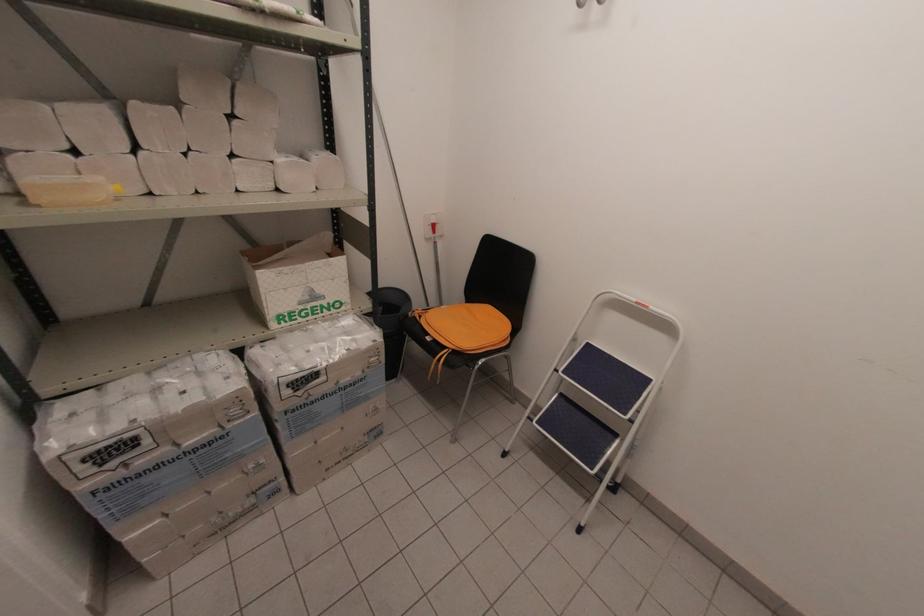
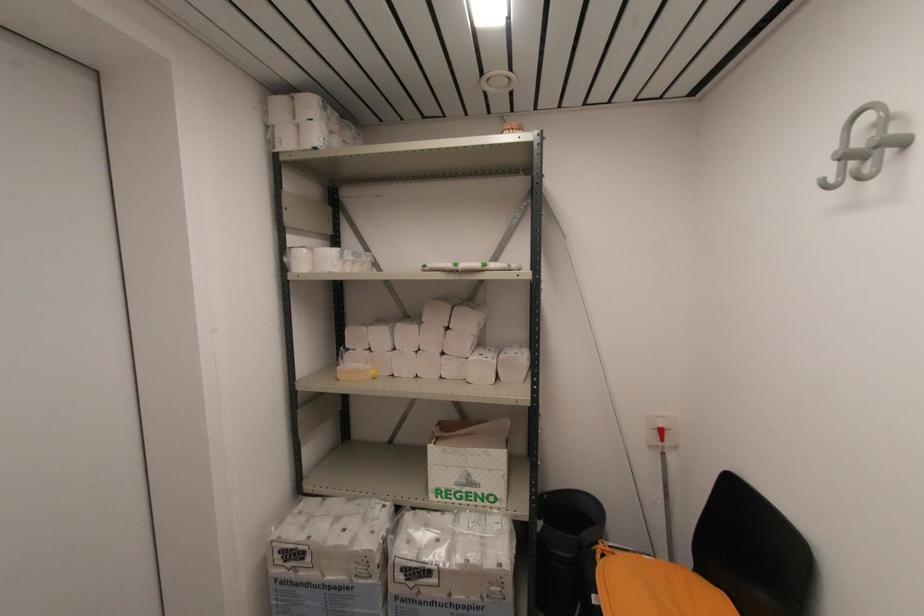
In the second image, find the point that corresponds to point (336, 322) in the first image.

(484, 517)